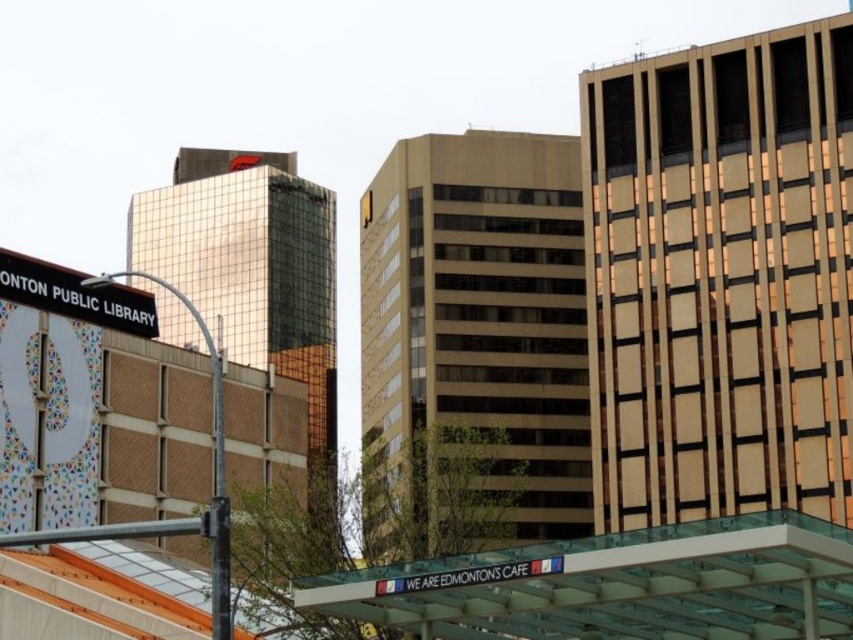
Question: Estimate the real-world distances between objects in this image. Which object is closer to the transparent glass canopy at lower center?

Choices:
 (A) metallic pole at left
 (B) black metal sign at upper left

Answer: (A)

Question: Can you confirm if transparent glass canopy at lower center is thinner than metallic pole at left?

Choices:
 (A) no
 (B) yes

Answer: (B)

Question: Which of the following is the closest to the observer?

Choices:
 (A) (212, 385)
 (B) (419, 563)

Answer: (B)

Question: Can you confirm if transparent glass canopy at lower center is positioned above black metal sign at upper left?

Choices:
 (A) yes
 (B) no

Answer: (B)

Question: Which is farther from the metallic pole at left?

Choices:
 (A) black metal sign at upper left
 (B) transparent glass canopy at lower center

Answer: (B)

Question: Can you confirm if black metal sign at upper left is wider than metallic pole at left?

Choices:
 (A) no
 (B) yes

Answer: (A)